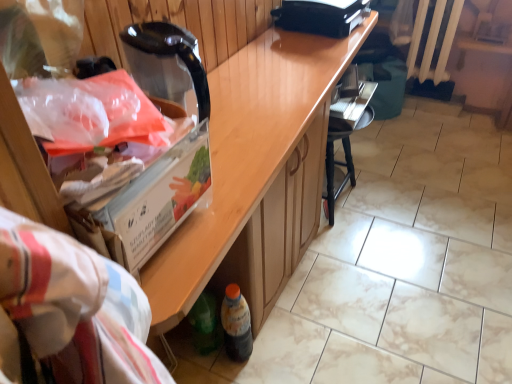
Question: Is wooden cabinet at center wider or thinner than black plastic chair at lower center?

Choices:
 (A) thin
 (B) wide

Answer: (B)

Question: From their relative heights in the image, would you say wooden cabinet at center is taller or shorter than black plastic chair at lower center?

Choices:
 (A) tall
 (B) short

Answer: (A)

Question: Which object is the closest to the white painted metal radiator at upper right?

Choices:
 (A) black plastic chair at lower center
 (B) translucent plastic bottle at lower center
 (C) black plastic printer at upper center
 (D) wooden cabinet at center

Answer: (A)

Question: Which of these objects is positioned closest to the translucent plastic bottle at lower center?

Choices:
 (A) white painted metal radiator at upper right
 (B) black plastic chair at lower center
 (C) wooden cabinet at center
 (D) black plastic printer at upper center

Answer: (C)